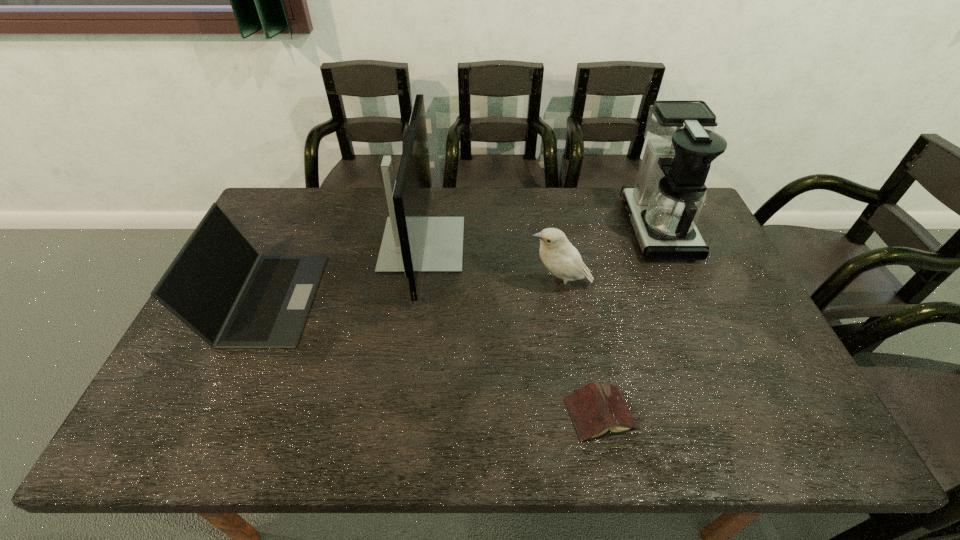
In order to click on free space between the fourth object from right to left and the book in this screenshot , I will do `click(512, 329)`.

The height and width of the screenshot is (540, 960). What are the coordinates of `free point between the book and the leftmost object` in the screenshot? It's located at (433, 356).

The width and height of the screenshot is (960, 540). In order to click on vacant space that is in between the second object from left to right and the bird in this screenshot , I will do 491,265.

I want to click on object that ranks as the fourth closest to the coffee maker, so click(218, 285).

Point out which object is positioned as the fourth nearest to the bird. Please provide its 2D coordinates. Your answer should be formatted as a tuple, i.e. [(x, y)], where the tuple contains the x and y coordinates of a point satisfying the conditions above.

[(218, 285)]

What are the coordinates of `vacant space that satisfies the following two spatial constraints: 1. on the screen of the computer monitor; 2. on the back side of the shortest object` in the screenshot? It's located at pos(399,414).

Image resolution: width=960 pixels, height=540 pixels. Identify the location of vacant area that satisfies the following two spatial constraints: 1. on the screen of the leftmost object; 2. on the left side of the book. (215, 414).

At what (x,y) coordinates should I click in order to perform the action: click on free space that satisfies the following two spatial constraints: 1. at the front of the coffee maker where the controls are located; 2. on the front side of the nearest object. Please return your answer as a coordinate pair (x, y). Image resolution: width=960 pixels, height=540 pixels. Looking at the image, I should click on (737, 414).

Identify the location of vacant space that satisfies the following two spatial constraints: 1. at the front of the coffee maker where the controls are located; 2. on the front side of the nearest object. The image size is (960, 540). (737, 414).

Where is `free space that satisfies the following two spatial constraints: 1. on the screen of the leftmost object; 2. on the right side of the nearest object`? free space that satisfies the following two spatial constraints: 1. on the screen of the leftmost object; 2. on the right side of the nearest object is located at coordinates (215, 414).